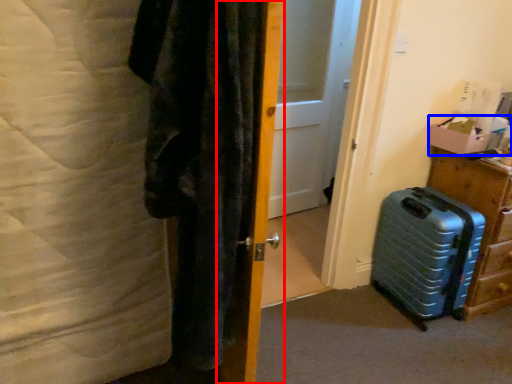
Question: Which object is closer to the camera taking this photo, door (highlighted by a red box) or box (highlighted by a blue box)?

Choices:
 (A) door
 (B) box

Answer: (A)